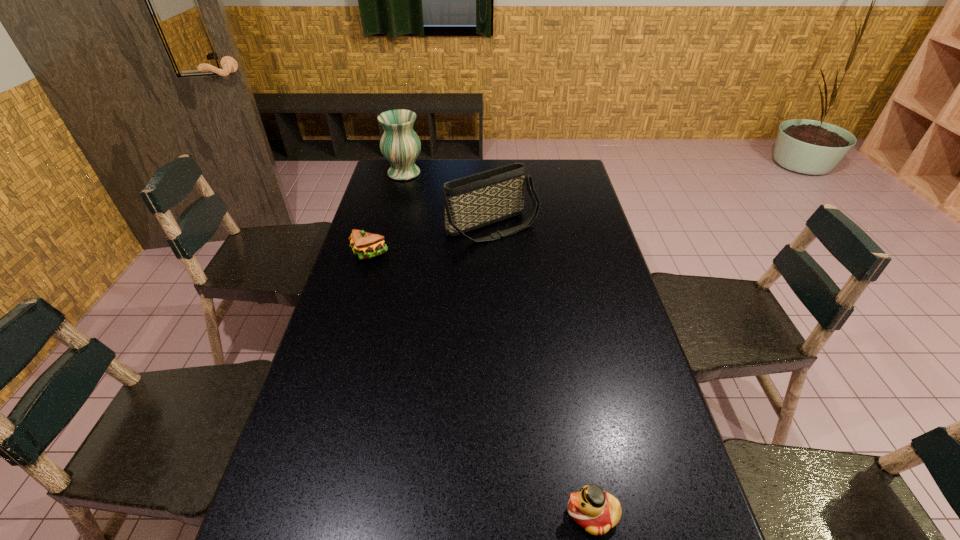
This screenshot has width=960, height=540. What are the coordinates of `free space located 0.390m on the face of the duck` in the screenshot? It's located at (372, 514).

Find the location of a particular element. This screenshot has height=540, width=960. object present at the far edge is located at coordinates (400, 145).

Where is `vase positioned at the left edge`? The width and height of the screenshot is (960, 540). vase positioned at the left edge is located at coordinates (400, 145).

Where is `sandwich present at the left edge`? The height and width of the screenshot is (540, 960). sandwich present at the left edge is located at coordinates (366, 245).

Where is `object at the right edge`? The height and width of the screenshot is (540, 960). object at the right edge is located at coordinates (595, 510).

The image size is (960, 540). What are the coordinates of `object at the far left corner` in the screenshot? It's located at (400, 145).

This screenshot has width=960, height=540. What are the coordinates of `vacant position at the far edge of the desktop` in the screenshot? It's located at (426, 160).

In the image, there is a desktop. What are the coordinates of `vacant region at the left edge` in the screenshot? It's located at (362, 387).

The image size is (960, 540). In the image, there is a desktop. Find the location of `vacant space at the right edge`. vacant space at the right edge is located at coordinates (596, 293).

In the image, there is a desktop. Where is `blank space at the far left corner`? The height and width of the screenshot is (540, 960). blank space at the far left corner is located at coordinates (417, 164).